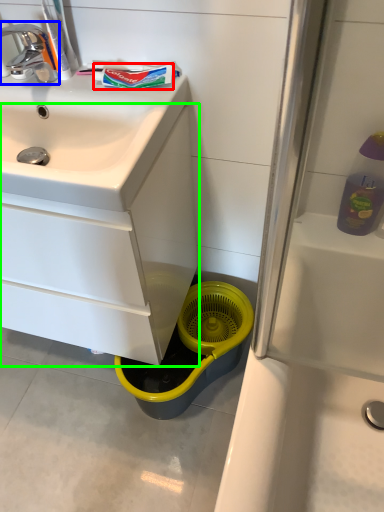
Question: Which is farther away from toothpaste (highlighted by a red box)? tap (highlighted by a blue box) or bathroom cabinet (highlighted by a green box)?

Choices:
 (A) tap
 (B) bathroom cabinet

Answer: (B)